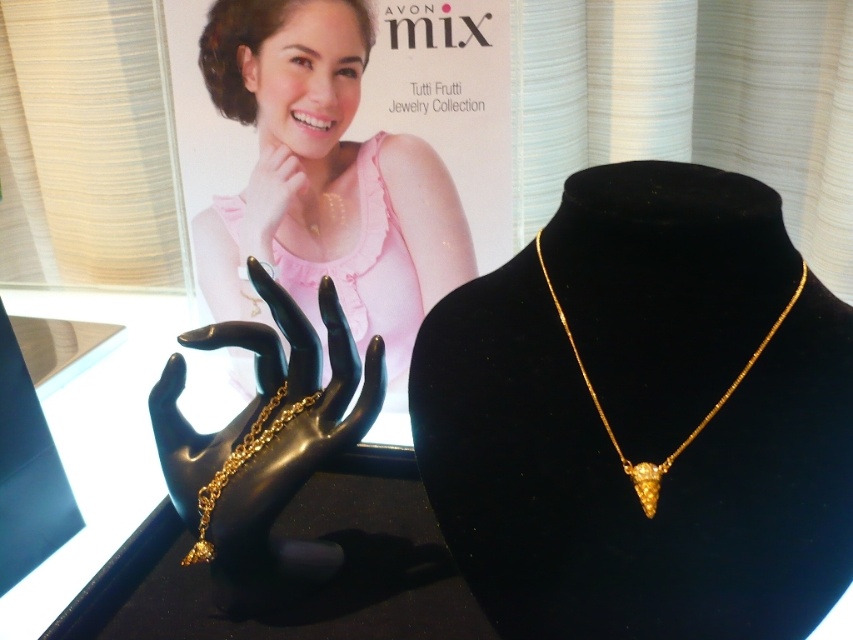
Consider the image. You are a customer looking at the Avon Mix Tutti Frutti Jewelry Collection display. You see the matte gold necklace at center and the gold chain at center. Which one appears closer to you?

The matte gold necklace at center appears closer to you because it is positioned further to the viewer than the gold chain at center.

You are a customer trying to decide between the matte gold necklace at center and the gold chain at center. The store has a policy that items must be at least 16 inches apart to be considered for a combo deal. Can you get a discount if you buy both?

The matte gold necklace at center is 16.66 inches from the gold chain at center, which exceeds the 16 inches requirement. Therefore, you can get a discount if you buy both.